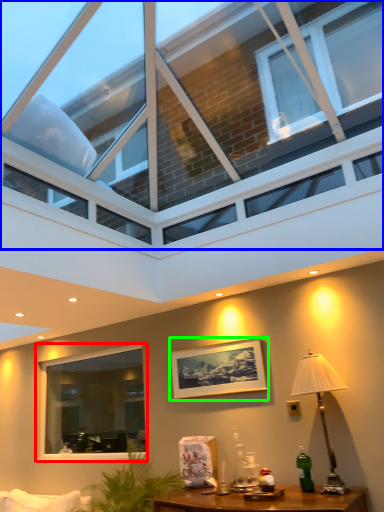
Question: Estimate the real-world distances between objects in this image. Which object is farther from window (highlighted by a red box), window (highlighted by a blue box) or picture frame (highlighted by a green box)?

Choices:
 (A) window
 (B) picture frame

Answer: (A)